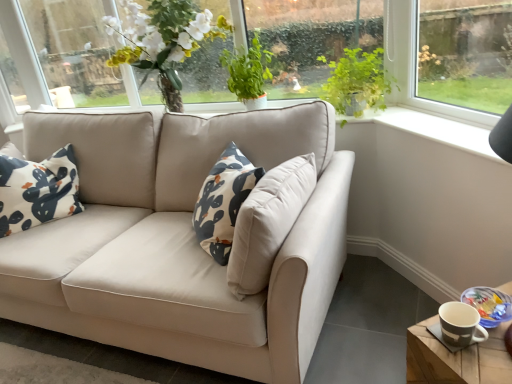
Question: Based on their positions, is green leafy plant at upper right, which appears as the 2th plant when viewed from the left, located to the left or right of green leafy plant at upper center, marked as the first plant in a left-to-right arrangement?

Choices:
 (A) right
 (B) left

Answer: (A)

Question: Is green leafy plant at upper right, which appears as the 2th plant when viewed from the left, inside or outside of green leafy plant at upper center, positioned as the second plant in right-to-left order?

Choices:
 (A) outside
 (B) inside

Answer: (A)

Question: Which object is positioned farthest from the green leafy plant at upper right, which appears as the 2th plant when viewed from the left?

Choices:
 (A) green leafy plant at upper center, marked as the first plant in a left-to-right arrangement
 (B) clear glass window at upper right
 (C) wooden coaster at lower right
 (D) matte brown mug at lower right

Answer: (C)

Question: Estimate the real-world distances between objects in this image. Which object is farther from the green leafy plant at upper right, which appears as the 2th plant when viewed from the left?

Choices:
 (A) matte brown mug at lower right
 (B) green leafy plant at upper center, marked as the first plant in a left-to-right arrangement
 (C) wooden coaster at lower right
 (D) clear glass window at upper right

Answer: (C)